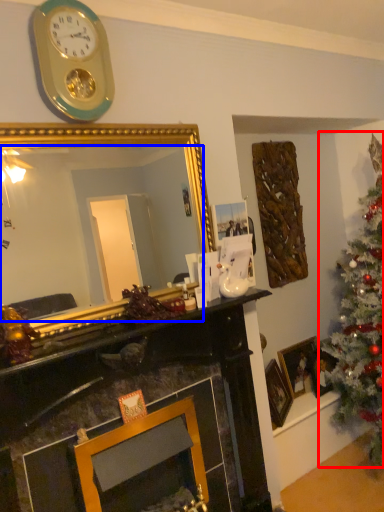
Question: Among these objects, which one is nearest to the camera, christmas tree (highlighted by a red box) or mirror (highlighted by a blue box)?

Choices:
 (A) christmas tree
 (B) mirror

Answer: (B)